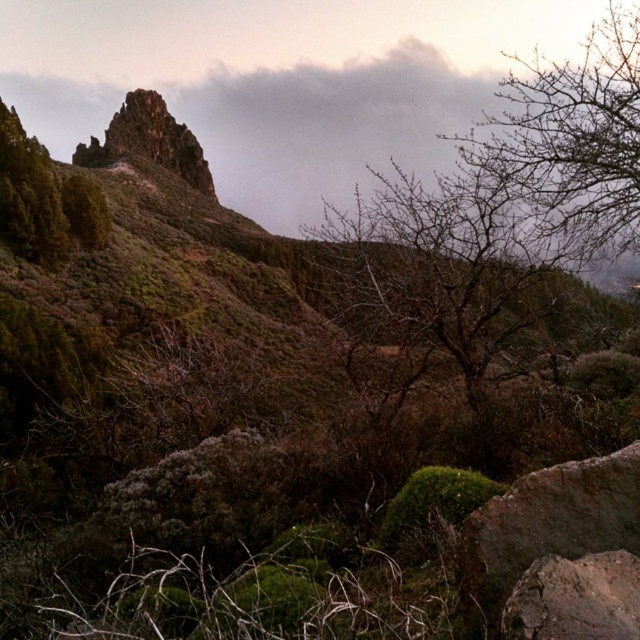
You are a hiker navigating through this rocky terrain. You need to move from the green matte rock at upper left to the rusty rock at lower right. Which direction should you head to reach your destination?

You should head to the right to reach the rusty rock at lower right from the green matte rock at upper left, as the rusty rock at lower right is positioned to the right of the green matte rock at upper left.